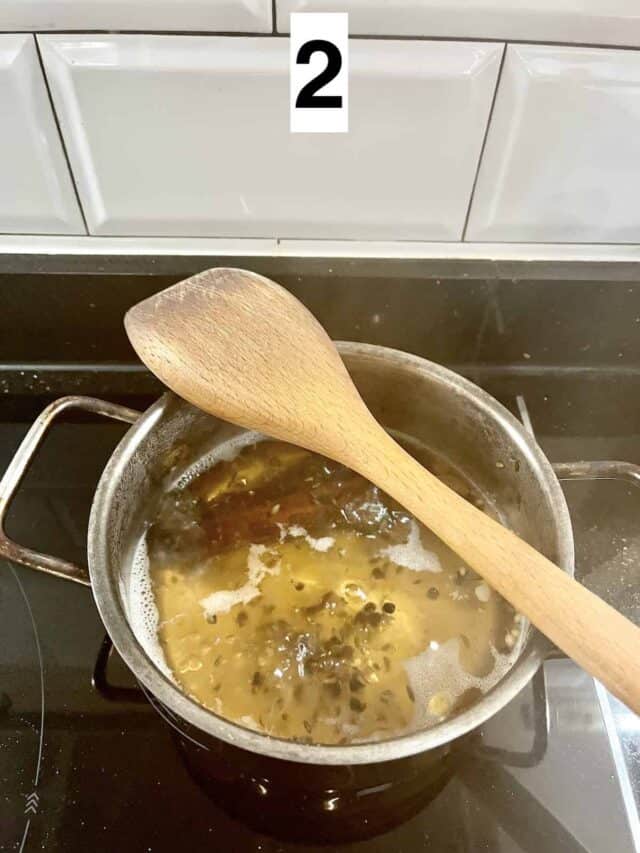
What are the coordinates of `black glass stove top, electric` in the screenshot? It's located at (554, 384).